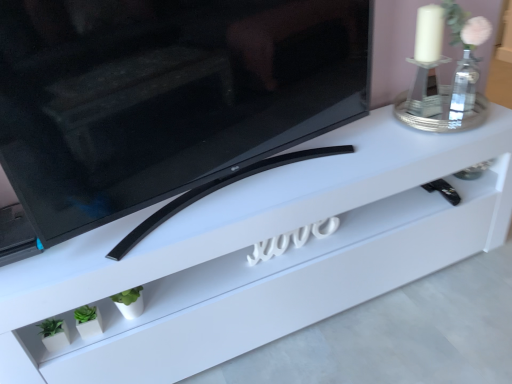
Identify the location of blank area beneath black glossy tv at center (from a real-world perspective). This screenshot has width=512, height=384. (234, 185).